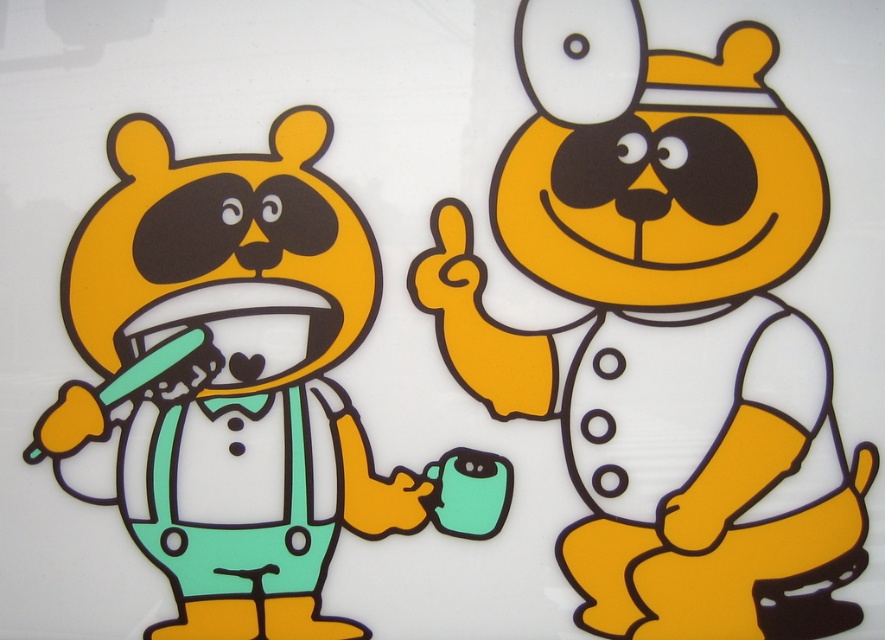
Is point (606, 572) closer to viewer compared to point (372, 508)?

No, (606, 572) is behind (372, 508).

Consider the image. Who is more distant from viewer, (787,202) or (322,506)?

Positioned behind is point (322,506).

This screenshot has width=885, height=640. In order to click on matte plastic bear at center in this screenshot , I will do `click(667, 333)`.